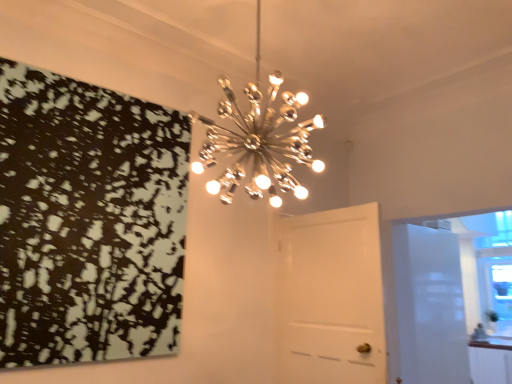
Question: Can you confirm if metallic starburst chandelier at upper center is wider than white glossy door at right, the first door positioned from the right?

Choices:
 (A) yes
 (B) no

Answer: (A)

Question: Is metallic starburst chandelier at upper center thinner than white glossy door at right, which is the first door in back-to-front order?

Choices:
 (A) no
 (B) yes

Answer: (A)

Question: Is the position of metallic starburst chandelier at upper center more distant than that of white glossy door at right, which appears as the 2th door when viewed from the left?

Choices:
 (A) no
 (B) yes

Answer: (A)

Question: Can we say metallic starburst chandelier at upper center lies outside white glossy door at right, which is the first door in back-to-front order?

Choices:
 (A) no
 (B) yes

Answer: (B)

Question: Can you confirm if metallic starburst chandelier at upper center is positioned to the left of white glossy door at right, which is the first door in back-to-front order?

Choices:
 (A) no
 (B) yes

Answer: (B)

Question: Considering the positions of point (94, 157) and point (505, 375), is point (94, 157) closer or farther from the camera than point (505, 375)?

Choices:
 (A) closer
 (B) farther

Answer: (A)

Question: From a real-world perspective, is black matte print at upper left positioned above or below white glossy cabinetry at lower right?

Choices:
 (A) below
 (B) above

Answer: (B)

Question: Is black matte print at upper left in front of or behind white glossy cabinetry at lower right in the image?

Choices:
 (A) behind
 (B) front

Answer: (B)

Question: Is black matte print at upper left inside or outside of white glossy cabinetry at lower right?

Choices:
 (A) inside
 (B) outside

Answer: (B)

Question: From a real-world perspective, is white glossy door at center, the 2th door positioned from the back, physically located above or below metallic starburst chandelier at upper center?

Choices:
 (A) below
 (B) above

Answer: (A)

Question: Considering the positions of white glossy door at center, the 2th door positioned from the right, and metallic starburst chandelier at upper center in the image, is white glossy door at center, the 2th door positioned from the right, bigger or smaller than metallic starburst chandelier at upper center?

Choices:
 (A) small
 (B) big

Answer: (A)

Question: Considering the positions of white glossy door at center, the 2th door positioned from the right, and metallic starburst chandelier at upper center in the image, is white glossy door at center, the 2th door positioned from the right, taller or shorter than metallic starburst chandelier at upper center?

Choices:
 (A) short
 (B) tall

Answer: (B)

Question: Based on their positions, is white glossy door at center, placed as the 1th door when sorted from front to back, located to the left or right of metallic starburst chandelier at upper center?

Choices:
 (A) left
 (B) right

Answer: (B)

Question: From a real-world perspective, relative to white glossy cabinetry at lower right, is white glossy door at center, placed as the 1th door when sorted from front to back, vertically above or below?

Choices:
 (A) below
 (B) above

Answer: (B)

Question: Is white glossy door at center, the 1th door from the left, in front of or behind white glossy cabinetry at lower right in the image?

Choices:
 (A) front
 (B) behind

Answer: (A)